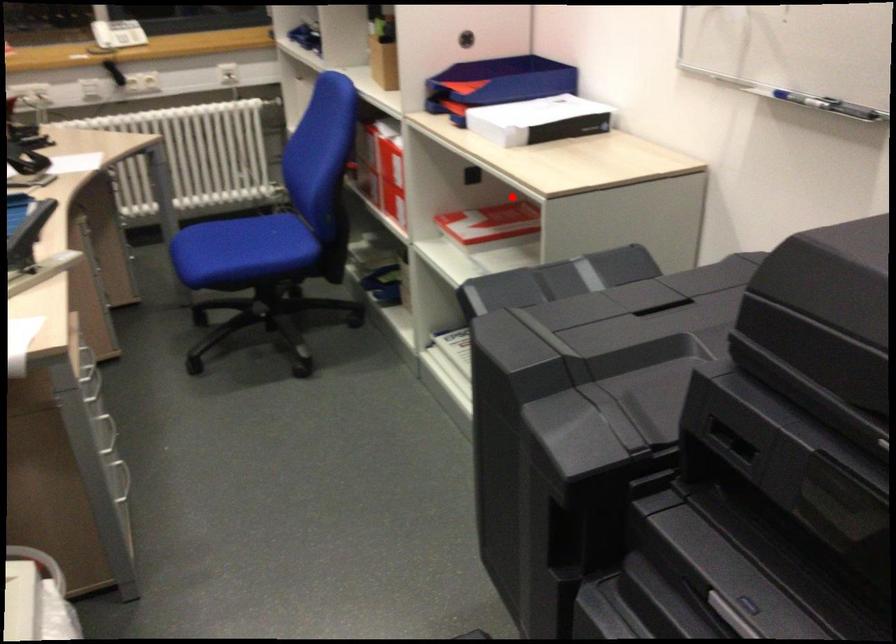
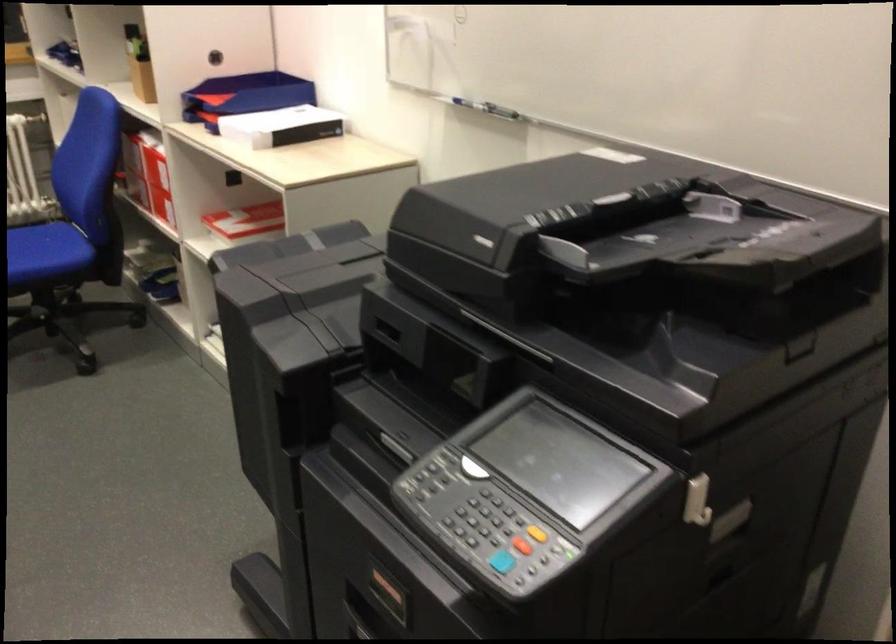
In the second image, find the point that corresponds to the highlighted location in the first image.

(271, 198)